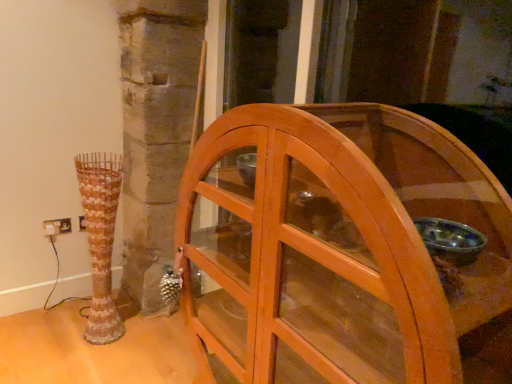
Question: In terms of size, does white plastic electric outlet at lower left appear bigger or smaller than rustic ceramic vase at left?

Choices:
 (A) big
 (B) small

Answer: (B)

Question: In the image, is white plastic electric outlet at lower left on the left side or the right side of rustic ceramic vase at left?

Choices:
 (A) right
 (B) left

Answer: (B)

Question: Estimate the real-world distances between objects in this image. Which object is farther from the rustic ceramic vase at left?

Choices:
 (A) wooden cabinet at center
 (B) white plastic electric outlet at lower left

Answer: (A)

Question: Which of these objects is positioned closest to the rustic ceramic vase at left?

Choices:
 (A) wooden cabinet at center
 (B) white plastic electric outlet at lower left

Answer: (B)